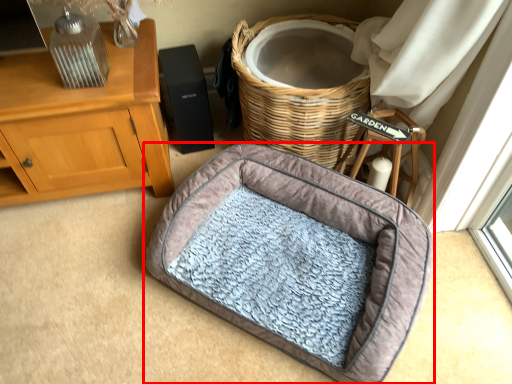
Question: Observing the image, what is the correct spatial positioning of dog bed (annotated by the red box) in reference to basket?

Choices:
 (A) right
 (B) left

Answer: (B)